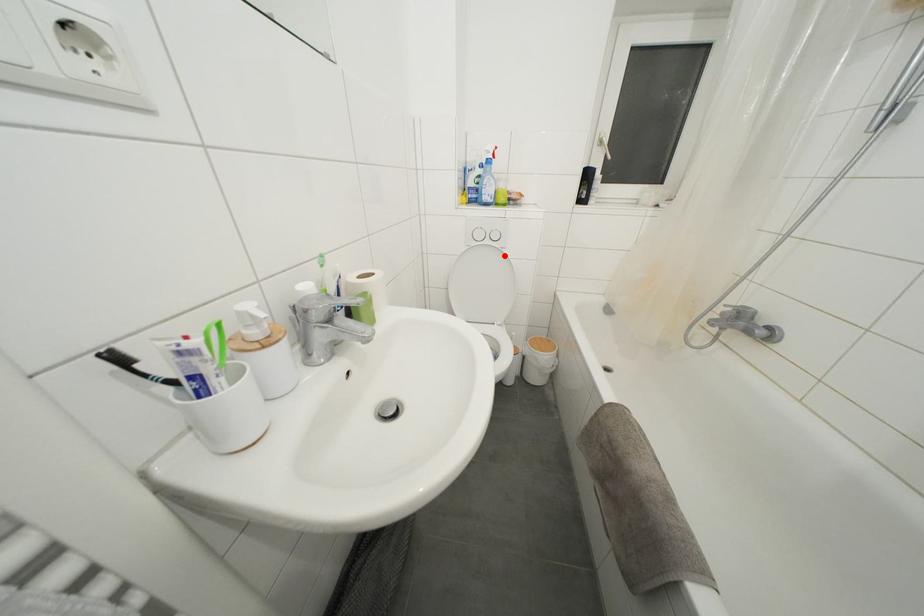
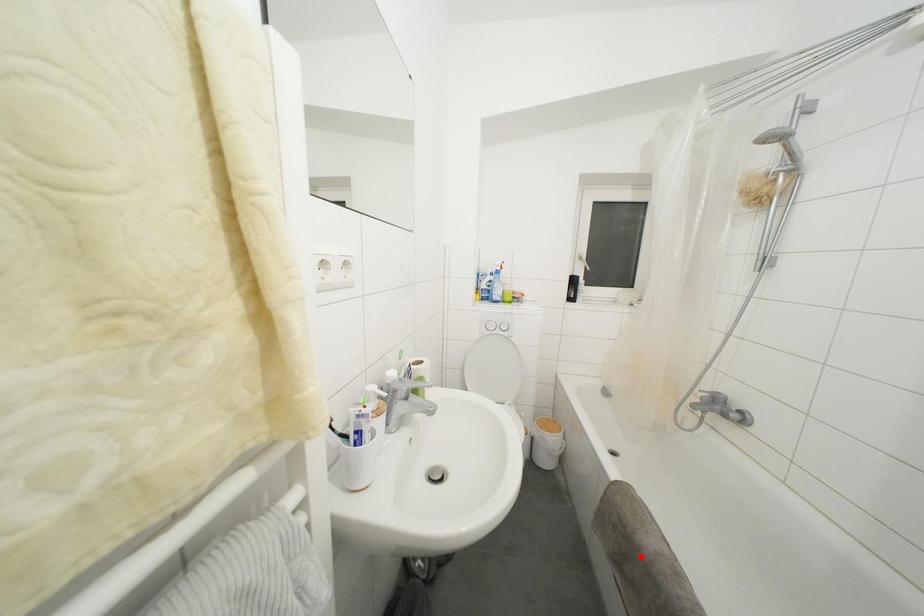
I am providing you with two images of the same scene from different viewpoints. A red point is marked on the first image and another point is marked on the second image. Is the red point in image1 aligned with the point shown in image2?

No